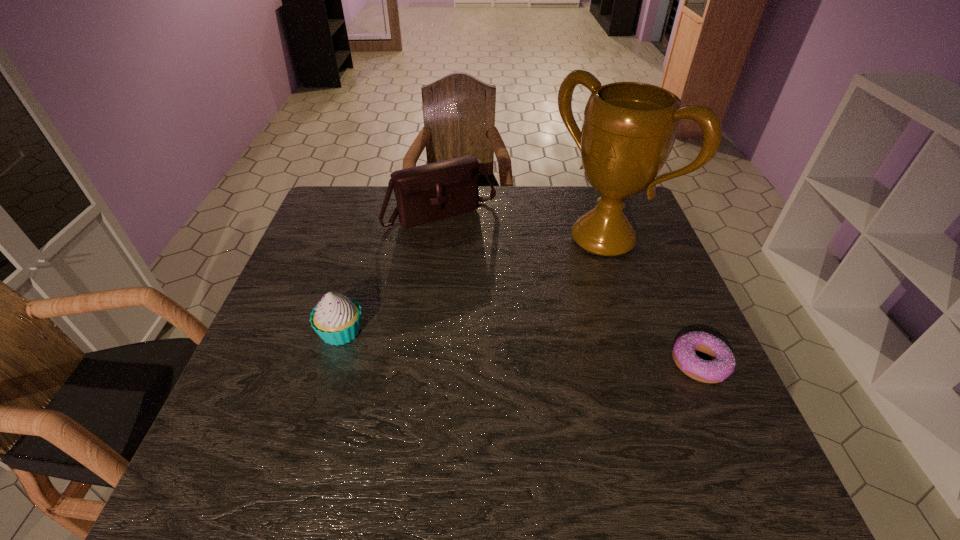
At what (x,y) coordinates should I click in order to perform the action: click on free point between the tallest object and the shortest object. Please return your answer as a coordinate pair (x, y). Looking at the image, I should click on (652, 301).

Find the location of a particular element. blank region between the doughnut and the shoulder bag is located at coordinates (571, 288).

This screenshot has width=960, height=540. What are the coordinates of `free area in between the shortest object and the second tallest object` in the screenshot? It's located at (571, 288).

Select which object appears as the third closest to the cupcake. Please provide its 2D coordinates. Your answer should be formatted as a tuple, i.e. [(x, y)], where the tuple contains the x and y coordinates of a point satisfying the conditions above.

[(722, 365)]

This screenshot has height=540, width=960. Identify the location of object that is the second closest one to the second shortest object. (629, 128).

This screenshot has height=540, width=960. In order to click on free space that satisfies the following two spatial constraints: 1. on the front side of the second tallest object; 2. on the left side of the tallest object in this screenshot , I will do `click(438, 239)`.